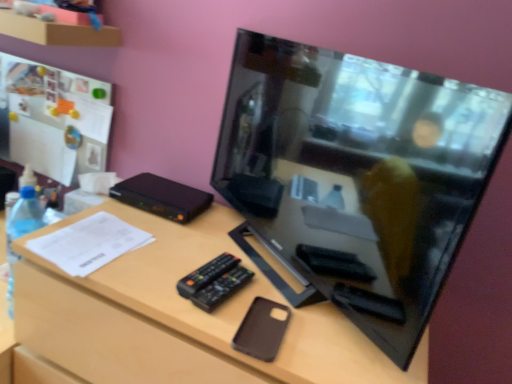
At what (x,y) coordinates should I click in order to perform the action: click on empty space that is ontop of brown matte phone case at center (from a real-world perspective). Please return your answer as a coordinate pair (x, y). The image size is (512, 384). Looking at the image, I should click on (226, 268).